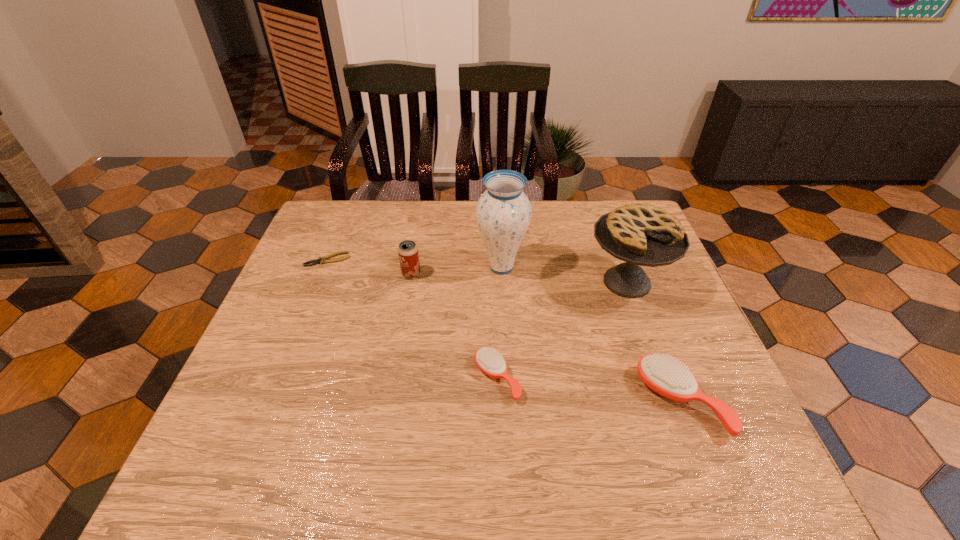
Please show where to add a hairbrush on the left while keeping spacing even. Please provide its 2D coordinates. Your answer should be formatted as a tuple, i.e. [(x, y)], where the tuple contains the x and y coordinates of a point satisfying the conditions above.

[(328, 358)]